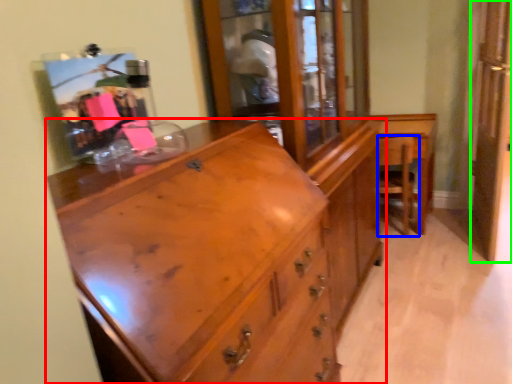
Question: Which object is positioned farthest from chest of drawers (highlighted by a red box)? Select from armchair (highlighted by a blue box) and screen door (highlighted by a green box).

Choices:
 (A) armchair
 (B) screen door

Answer: (B)